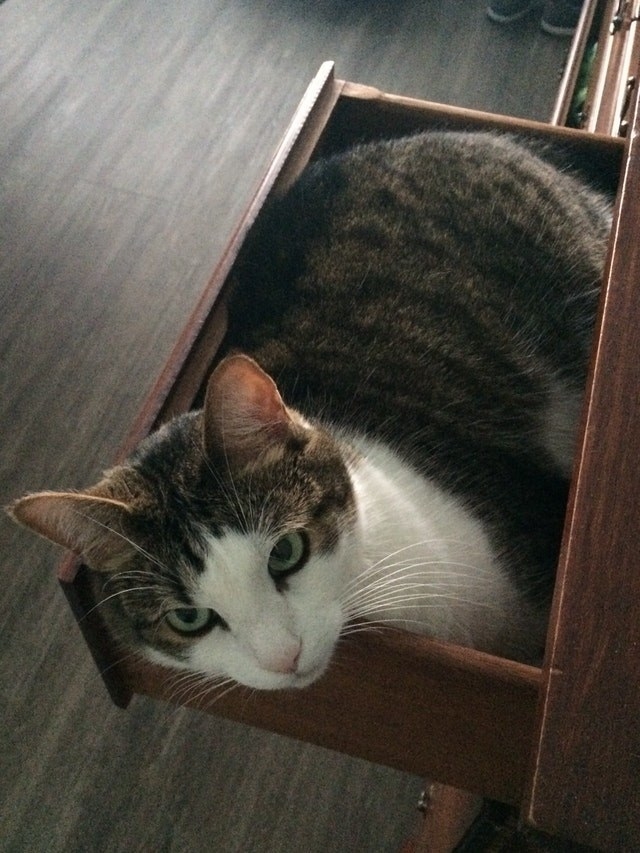
Image resolution: width=640 pixels, height=853 pixels. In order to click on top drawer in this screenshot , I will do `click(444, 698)`.